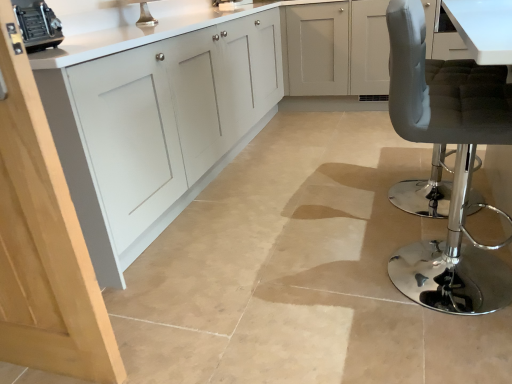
Question: Is matte gray cushioned stool at right placed right next to matte white cabinets at center?

Choices:
 (A) yes
 (B) no

Answer: (B)

Question: Considering the relative sizes of matte gray cushioned stool at right and matte white cabinets at center in the image provided, is matte gray cushioned stool at right bigger than matte white cabinets at center?

Choices:
 (A) yes
 (B) no

Answer: (B)

Question: Could you tell me if matte gray cushioned stool at right is facing matte white cabinets at center?

Choices:
 (A) no
 (B) yes

Answer: (A)

Question: Is the depth of matte gray cushioned stool at right greater than that of matte white cabinets at center?

Choices:
 (A) no
 (B) yes

Answer: (A)

Question: Does matte gray cushioned stool at right contain matte white cabinets at center?

Choices:
 (A) no
 (B) yes

Answer: (A)

Question: In terms of size, does metallic silver toaster at upper left appear bigger or smaller than matte white cabinets at center?

Choices:
 (A) big
 (B) small

Answer: (B)

Question: Is point (27, 8) closer or farther from the camera than point (117, 188)?

Choices:
 (A) farther
 (B) closer

Answer: (B)

Question: Based on their positions, is metallic silver toaster at upper left located to the left or right of matte white cabinets at center?

Choices:
 (A) right
 (B) left

Answer: (B)

Question: From the image's perspective, is metallic silver toaster at upper left positioned above or below matte white cabinets at center?

Choices:
 (A) below
 (B) above

Answer: (A)

Question: Is point (446, 309) positioned closer to the camera than point (41, 16)?

Choices:
 (A) farther
 (B) closer

Answer: (B)

Question: Considering the positions of matte gray cushioned stool at right and metallic silver toaster at upper left in the image, is matte gray cushioned stool at right wider or thinner than metallic silver toaster at upper left?

Choices:
 (A) thin
 (B) wide

Answer: (B)

Question: From a real-world perspective, is matte gray cushioned stool at right positioned above or below metallic silver toaster at upper left?

Choices:
 (A) below
 (B) above

Answer: (A)

Question: Is matte gray cushioned stool at right inside or outside of metallic silver toaster at upper left?

Choices:
 (A) inside
 (B) outside

Answer: (B)

Question: Is metallic silver toaster at upper left taller or shorter than matte gray cushioned stool at right?

Choices:
 (A) short
 (B) tall

Answer: (A)

Question: Based on their positions, is metallic silver toaster at upper left located to the left or right of matte gray cushioned stool at right?

Choices:
 (A) left
 (B) right

Answer: (A)